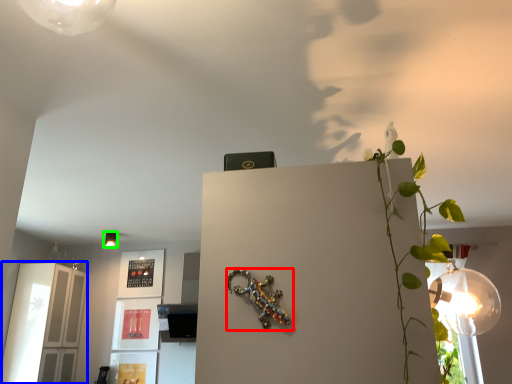
Question: Based on their relative distances, which object is nearer to lizard (highlighted by a red box)? Choose from glass door (highlighted by a blue box) and lamp (highlighted by a green box).

Choices:
 (A) glass door
 (B) lamp

Answer: (A)